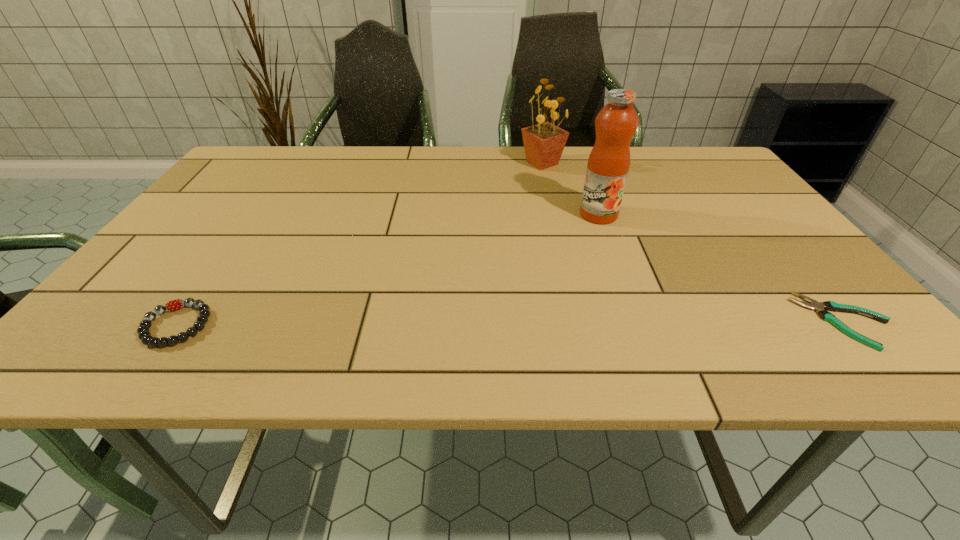
Find the location of `the leftmost object`. the leftmost object is located at coordinates (144, 335).

Identify the location of the second shortest object. The height and width of the screenshot is (540, 960). (144, 335).

I want to click on the shortest object, so click(x=814, y=305).

Locate an element on the screen. This screenshot has height=540, width=960. the rightmost object is located at coordinates (814, 305).

Identify the location of the tallest object. (608, 165).

This screenshot has height=540, width=960. Identify the location of the second farthest object. (608, 165).

Locate an element on the screen. The height and width of the screenshot is (540, 960). the farthest object is located at coordinates (544, 143).

I want to click on sunflower, so click(x=544, y=143).

Where is `blank area located 0.310m on the back of the leftmost object`? The image size is (960, 540). blank area located 0.310m on the back of the leftmost object is located at coordinates (252, 217).

The width and height of the screenshot is (960, 540). Identify the location of vacant space positioned 0.210m on the back of the shortest object. (771, 233).